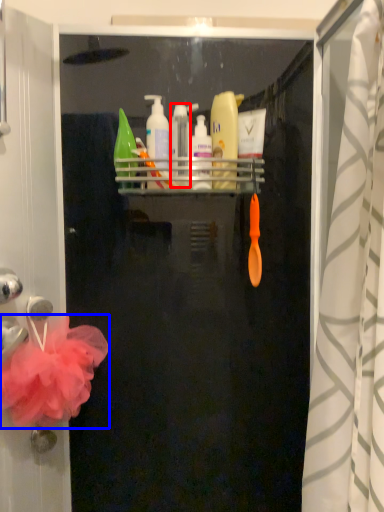
Question: Which of the following is the closest to the observer, toiletry (highlighted by a red box) or bath towel (highlighted by a blue box)?

Choices:
 (A) toiletry
 (B) bath towel

Answer: (B)